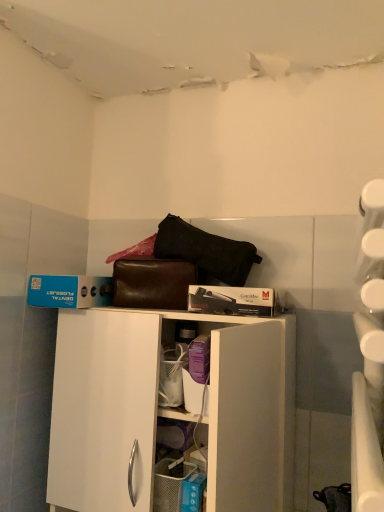
Describe the element at coordinates (170, 410) in the screenshot. This screenshot has height=512, width=384. I see `white matte cabinet at center` at that location.

Based on the photo, in order to face white matte cabinet at center, should I rotate leftwards or rightwards?

You should look left and rotate roughly 6.090 degrees.

Image resolution: width=384 pixels, height=512 pixels. I want to click on white matte cabinet at center, so click(170, 410).

Find the location of a particular element. This screenshot has height=512, width=384. white matte cabinet at center is located at coordinates (170, 410).